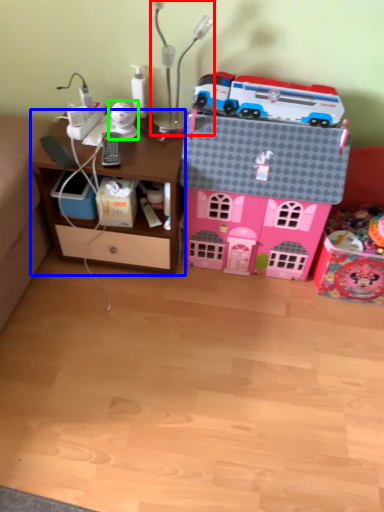
Question: Considering the real-world distances, which object is farthest from table lamp (highlighted by a red box)? computer desk (highlighted by a blue box) or toy (highlighted by a green box)?

Choices:
 (A) computer desk
 (B) toy

Answer: (A)